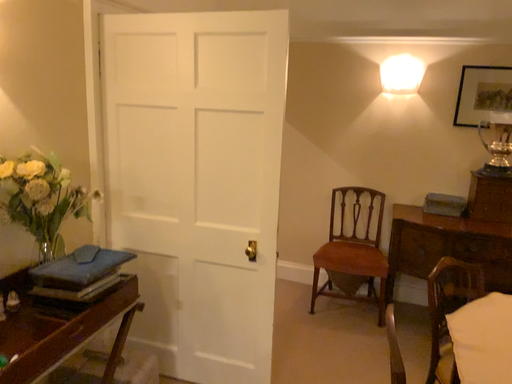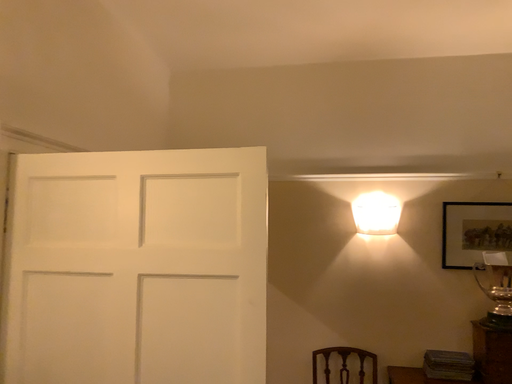
Question: How did the camera likely rotate when shooting the video?

Choices:
 (A) rotated left
 (B) rotated right

Answer: (B)